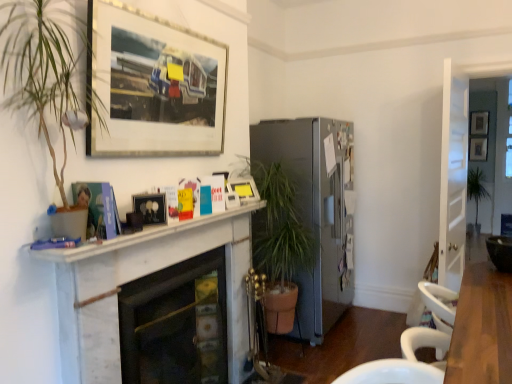
The height and width of the screenshot is (384, 512). I want to click on matte white fireplace at center, marked as the third fireplace in a front-to-back arrangement, so [x=316, y=210].

Where is `matte white picture frame at center, which is the third picture frame from left to right`? matte white picture frame at center, which is the third picture frame from left to right is located at coordinates (244, 189).

What do you see at coordinates (479, 122) in the screenshot? I see `matte silver picture frame at upper right, the 2th picture frame in the right-to-left sequence` at bounding box center [479, 122].

Locate an element on the screen. wooden picture frame at upper right, which is the 1th picture frame in right-to-left order is located at coordinates (478, 148).

You are a GUI agent. You are given a task and a screenshot of the screen. Output one action in this format:
    pyautogui.click(x=<x>, y=<y>)
    Task: Click on the 5th picture frame located above the white marble fireplace at upper center (from a real-world perspective)
    The width and height of the screenshot is (512, 384).
    Given the screenshot: What is the action you would take?
    pyautogui.click(x=153, y=85)

Between silver metallic picture frame at upper center, the 2th picture frame viewed from the left, and white marble fireplace at upper center, which one has more height?

Standing taller between the two is silver metallic picture frame at upper center, the 2th picture frame viewed from the left.

Is silver metallic picture frame at upper center, the fourth picture frame positioned from the right, in contact with white marble fireplace at upper center?

No, silver metallic picture frame at upper center, the fourth picture frame positioned from the right, is not in contact with white marble fireplace at upper center.

Between silver metallic picture frame at upper center, which is the first picture frame in front-to-back order, and white marble fireplace at upper center, which one has smaller size?

Smaller between the two is white marble fireplace at upper center.

The height and width of the screenshot is (384, 512). What are the coordinates of `mantle above the green leafy plant at right (from the image's perspective)` in the screenshot? It's located at (141, 236).

From the image's perspective, which object appears higher, green leafy plant at right or white marble fireplace at upper center?

white marble fireplace at upper center, from the image's perspective.

Is the surface of green leafy plant at right in direct contact with white marble fireplace at upper center?

No, green leafy plant at right is not with white marble fireplace at upper center.

From the image's perspective, is matte black picture frame at center, which is the first picture frame in left-to-right order, under green leafy plant at right?

No, from the image's perspective, matte black picture frame at center, which is the first picture frame in left-to-right order, is not below green leafy plant at right.

Between matte black picture frame at center, the second picture frame viewed from the front, and green leafy plant at right, which one has less height?

matte black picture frame at center, the second picture frame viewed from the front.

Does matte black picture frame at center, which is counted as the 4th picture frame, starting from the back, touch green leafy plant at right?

matte black picture frame at center, which is counted as the 4th picture frame, starting from the back, and green leafy plant at right are not in contact.

In the scene shown: Is matte black picture frame at center, the second picture frame viewed from the front, inside or outside of green leafy plant at right?

The correct answer is: outside.

Is white marble fireplace at center, the 1th fireplace in the front-to-back sequence, facing towards white glossy door at right?

No, white marble fireplace at center, the 1th fireplace in the front-to-back sequence, is not facing towards white glossy door at right.

How many degrees apart are the facing directions of white marble fireplace at center, arranged as the 3th fireplace when viewed from the back, and white glossy door at right?

4.57 degrees.

Does white marble fireplace at center, arranged as the 3th fireplace when viewed from the back, appear on the right side of white glossy door at right?

Incorrect, white marble fireplace at center, arranged as the 3th fireplace when viewed from the back, is not on the right side of white glossy door at right.

Which is farther, [241,219] or [454,175]?

Point [454,175]

Could you tell me if white marble fireplace at center, arranged as the 3th fireplace when viewed from the back, is facing matte silver picture frame at upper right, acting as the 2th picture frame starting from the back?

No, white marble fireplace at center, arranged as the 3th fireplace when viewed from the back, does not turn towards matte silver picture frame at upper right, acting as the 2th picture frame starting from the back.

Based on their sizes in the image, would you say white marble fireplace at center, arranged as the 3th fireplace when viewed from the back, is bigger or smaller than matte silver picture frame at upper right, acting as the 2th picture frame starting from the back?

In the image, white marble fireplace at center, arranged as the 3th fireplace when viewed from the back, appears to be larger than matte silver picture frame at upper right, acting as the 2th picture frame starting from the back.

Which is behind, point (65, 265) or point (478, 122)?

Positioned behind is point (478, 122).

Is matte white fireplace at center, which appears as the first fireplace when viewed from the back, shorter than matte white picture frame at center, marked as the 3th picture frame in a front-to-back arrangement?

Incorrect, the height of matte white fireplace at center, which appears as the first fireplace when viewed from the back, does not fall short of that of matte white picture frame at center, marked as the 3th picture frame in a front-to-back arrangement.

Considering the sizes of matte white fireplace at center, marked as the third fireplace in a front-to-back arrangement, and matte white picture frame at center, which is the third picture frame from left to right, in the image, is matte white fireplace at center, marked as the third fireplace in a front-to-back arrangement, bigger or smaller than matte white picture frame at center, which is the third picture frame from left to right,?

A: matte white fireplace at center, marked as the third fireplace in a front-to-back arrangement, is bigger than matte white picture frame at center, which is the third picture frame from left to right.

Is matte white fireplace at center, which appears as the first fireplace when viewed from the back, not inside matte white picture frame at center, marked as the 3th picture frame in a front-to-back arrangement?

matte white fireplace at center, which appears as the first fireplace when viewed from the back, lies outside matte white picture frame at center, marked as the 3th picture frame in a front-to-back arrangement,'s area.

Is matte white fireplace at center, which appears as the first fireplace when viewed from the back, at the left side of matte white picture frame at center, which ranks as the third picture frame in back-to-front order?

No.

Is point (477, 207) closer to viewer compared to point (163, 287)?

No, it is not.

From the image's perspective, which object appears higher, green leafy plant at right or white marble fireplace at center, the 2th fireplace when ordered from back to front?

From the image's view, green leafy plant at right is above.

Is green leafy plant at right looking in the opposite direction of white marble fireplace at center, arranged as the second fireplace when viewed from the front?

green leafy plant at right does not have its back to white marble fireplace at center, arranged as the second fireplace when viewed from the front.

Is green leafy plant at right smaller than white marble fireplace at center, arranged as the second fireplace when viewed from the front?

Actually, green leafy plant at right might be larger than white marble fireplace at center, arranged as the second fireplace when viewed from the front.

The image size is (512, 384). What are the coordinates of `mantle below the silver metallic picture frame at upper center, which is the fifth picture frame in back-to-front order (from a real-world perspective)` in the screenshot? It's located at (141, 236).

In order to click on mantle in front of the green leafy plant at right in this screenshot , I will do `click(141, 236)`.

Estimate the real-world distances between objects in this image. Which object is further from white marble fireplace at center, the 1th fireplace in the front-to-back sequence, matte black picture frame at center, the second picture frame viewed from the front, or white marble fireplace at upper center?

matte black picture frame at center, the second picture frame viewed from the front, is further to white marble fireplace at center, the 1th fireplace in the front-to-back sequence.

Based on the photo, based on their spatial positions, is matte silver picture frame at upper right, which is counted as the 4th picture frame, starting from the front, or green leafy plant at right further from white marble fireplace at center, arranged as the second fireplace when viewed from the front?

matte silver picture frame at upper right, which is counted as the 4th picture frame, starting from the front, is further to white marble fireplace at center, arranged as the second fireplace when viewed from the front.

Based on the photo, estimate the real-world distances between objects in this image. Which object is closer to matte silver picture frame at upper right, the fourth picture frame in the left-to-right sequence, white marble fireplace at center, the 1th fireplace in the front-to-back sequence, or silver metallic picture frame at upper center, which is the fifth picture frame in back-to-front order?

Based on the image, white marble fireplace at center, the 1th fireplace in the front-to-back sequence, appears to be nearer to matte silver picture frame at upper right, the fourth picture frame in the left-to-right sequence.

From the image, which object appears to be farther from white marble fireplace at center, arranged as the 3th fireplace when viewed from the back, matte white fireplace at center, marked as the third fireplace in a front-to-back arrangement, or green leafy plant at right?

Based on the image, green leafy plant at right appears to be further to white marble fireplace at center, arranged as the 3th fireplace when viewed from the back.

When comparing their distances from green leafy plant at right, does white marble fireplace at center, the 1th fireplace in the front-to-back sequence, or white glossy door at right seem further?

white marble fireplace at center, the 1th fireplace in the front-to-back sequence.

Looking at the image, which one is located closer to wooden picture frame at upper right, the 1th picture frame from the back, matte silver picture frame at upper right, the fourth picture frame in the left-to-right sequence, or white marble fireplace at center, arranged as the second fireplace when viewed from the front?

matte silver picture frame at upper right, the fourth picture frame in the left-to-right sequence.

Considering their positions, is white marble fireplace at center, arranged as the 3th fireplace when viewed from the back, positioned further to white glossy door at right than white marble fireplace at upper center?

white marble fireplace at center, arranged as the 3th fireplace when viewed from the back.

Which object lies further to the anchor point matte white picture frame at center, placed as the 3th picture frame when sorted from right to left, matte silver picture frame at upper right, which is counted as the 4th picture frame, starting from the front, or white marble fireplace at upper center?

matte silver picture frame at upper right, which is counted as the 4th picture frame, starting from the front, lies further to matte white picture frame at center, placed as the 3th picture frame when sorted from right to left, than the other object.

Identify the location of plant between white marble fireplace at center, arranged as the 3th fireplace when viewed from the back, and matte silver picture frame at upper right, the 2th picture frame in the right-to-left sequence, from front to back. (476, 188).

You are a GUI agent. You are given a task and a screenshot of the screen. Output one action in this format:
    pyautogui.click(x=<x>, y=<y>)
    Task: Click on the plant positioned between matte white fireplace at center, marked as the third fireplace in a front-to-back arrangement, and wooden picture frame at upper right, which is the 1th picture frame in right-to-left order, from near to far
    This screenshot has width=512, height=384.
    Given the screenshot: What is the action you would take?
    pyautogui.click(x=476, y=188)

The width and height of the screenshot is (512, 384). Identify the location of plant between white marble fireplace at center, arranged as the second fireplace when viewed from the front, and matte silver picture frame at upper right, which is counted as the 4th picture frame, starting from the front, along the z-axis. (476, 188).

Where is `mantle between matte black picture frame at center, which is counted as the 4th picture frame, starting from the back, and white glossy door at right, in the horizontal direction`? The height and width of the screenshot is (384, 512). mantle between matte black picture frame at center, which is counted as the 4th picture frame, starting from the back, and white glossy door at right, in the horizontal direction is located at coordinates (141, 236).